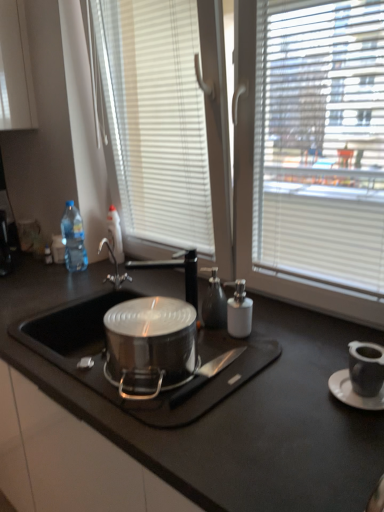
Where is `free space that is to the left of white ceramic saucer at lower right`? The width and height of the screenshot is (384, 512). free space that is to the left of white ceramic saucer at lower right is located at coordinates (291, 399).